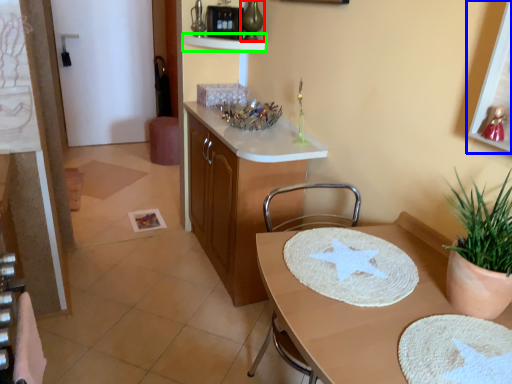
Question: Considering the real-world distances, which object is farthest from vase (highlighted by a red box)? picture frame (highlighted by a blue box) or shelf (highlighted by a green box)?

Choices:
 (A) picture frame
 (B) shelf

Answer: (A)